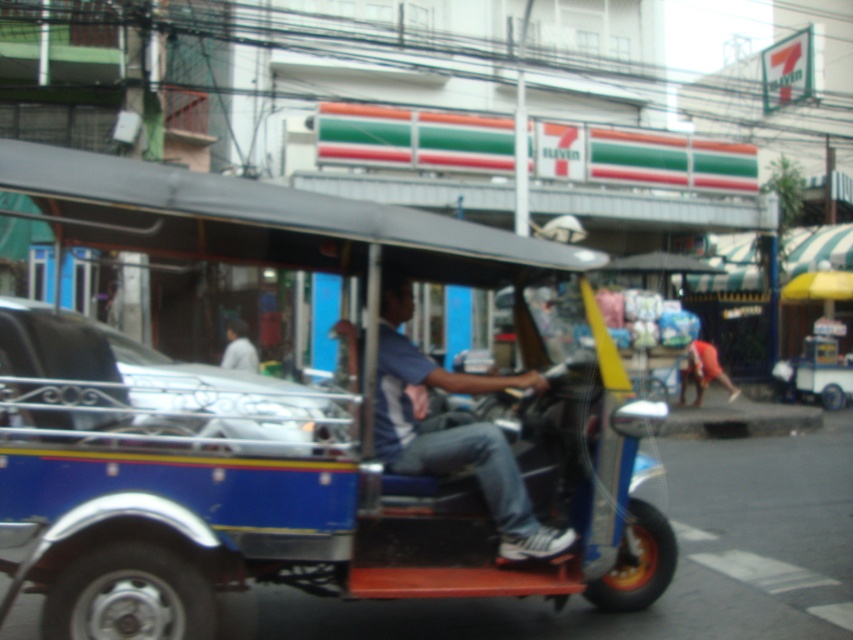
You are a delivery person who needs to place a package between the blue denim jeans at center and the light gray fabric shirt at center. Can you fit the package if it requires 30 feet of space?

The blue denim jeans at center and light gray fabric shirt at center are 27.83 feet apart from each other, so the package requiring 30 feet of space cannot fit between them.

You are a pedestrian standing at the edge of the street. You see a metallic silver car at center and a light gray fabric shirt at center. Which object is positioned to the right side from your viewpoint?

The metallic silver car at center is to the right of the light gray fabric shirt at center, so the metallic silver car at center is positioned to the right side from your viewpoint.

You are a tailor who needs to adjust the width of the blue denim jeans at center and the light gray fabric shirt at center. Which garment should you check first if you want to ensure they both fit through a narrow doorway?

You should check the blue denim jeans at center first because it might be wider than the light gray fabric shirt at center, so it is more likely to not fit through the narrow doorway.